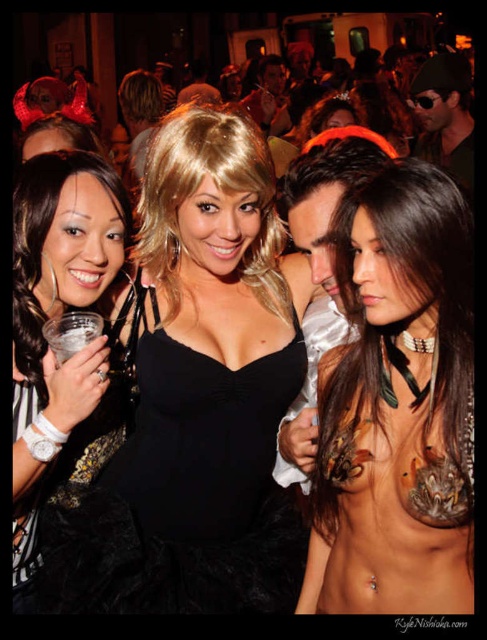
Can you confirm if black velvet dress at center is bigger than black lace dress at left?

Indeed, black velvet dress at center has a larger size compared to black lace dress at left.

Is black velvet dress at center wider than black lace dress at left?

Indeed, black velvet dress at center has a greater width compared to black lace dress at left.

Locate an element on the screen. The width and height of the screenshot is (487, 640). black velvet dress at center is located at coordinates (175, 488).

Who is more forward, (375,484) or (246,516)?

Point (375,484) is more forward.

Is point (392, 280) less distant than point (188, 454)?

Yes, it is in front of point (188, 454).

What do you see at coordinates (397, 406) in the screenshot?
I see `nude skin at center` at bounding box center [397, 406].

Where is `nude skin at center`? The width and height of the screenshot is (487, 640). nude skin at center is located at coordinates (397, 406).

Is black velvet dress at center bigger than clear plastic cup at left?

Indeed, black velvet dress at center has a larger size compared to clear plastic cup at left.

Is black velvet dress at center in front of clear plastic cup at left?

That is False.

What are the coordinates of `black velvet dress at center` in the screenshot? It's located at (175, 488).

Identify the location of black velvet dress at center. The image size is (487, 640). (175, 488).